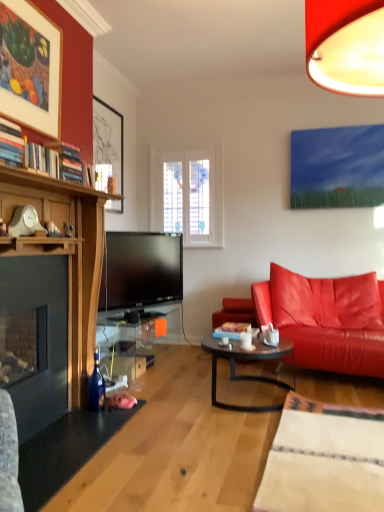
Question: From a real-world perspective, is dark brown glass coffee table at center over leather couch at right?

Choices:
 (A) no
 (B) yes

Answer: (A)

Question: Considering the relative sizes of dark brown glass coffee table at center and leather couch at right in the image provided, is dark brown glass coffee table at center thinner than leather couch at right?

Choices:
 (A) yes
 (B) no

Answer: (A)

Question: Considering the relative sizes of dark brown glass coffee table at center and leather couch at right in the image provided, is dark brown glass coffee table at center wider than leather couch at right?

Choices:
 (A) no
 (B) yes

Answer: (A)

Question: Is dark brown glass coffee table at center facing away from leather couch at right?

Choices:
 (A) no
 (B) yes

Answer: (B)

Question: Is dark brown glass coffee table at center positioned in front of leather couch at right?

Choices:
 (A) yes
 (B) no

Answer: (A)

Question: Considering the positions of point (39, 48) and point (251, 334), is point (39, 48) closer or farther from the camera than point (251, 334)?

Choices:
 (A) farther
 (B) closer

Answer: (B)

Question: Is matte wood picture frame at upper left, the second picture frame positioned from the back, spatially inside white ceramic mug at center, or outside of it?

Choices:
 (A) inside
 (B) outside

Answer: (B)

Question: In the image, is matte wood picture frame at upper left, which is counted as the 1th picture frame, starting from the front, on the left side or the right side of white ceramic mug at center?

Choices:
 (A) right
 (B) left

Answer: (B)

Question: Is matte wood picture frame at upper left, which is counted as the 1th picture frame, starting from the front, wider or thinner than white ceramic mug at center?

Choices:
 (A) thin
 (B) wide

Answer: (A)

Question: In the image, is leather couch at right positioned in front of or behind white ceramic mug at center?

Choices:
 (A) behind
 (B) front

Answer: (A)

Question: In the image, is leather couch at right on the left side or the right side of white ceramic mug at center?

Choices:
 (A) right
 (B) left

Answer: (A)

Question: In terms of width, does leather couch at right look wider or thinner when compared to white ceramic mug at center?

Choices:
 (A) wide
 (B) thin

Answer: (A)

Question: Considering the positions of leather couch at right and white ceramic mug at center in the image, is leather couch at right bigger or smaller than white ceramic mug at center?

Choices:
 (A) big
 (B) small

Answer: (A)

Question: Considering the relative positions of matte black picture frame at upper left, which is the second picture frame from front to back, and white ceramic mug at center in the image provided, is matte black picture frame at upper left, which is the second picture frame from front to back, to the left or to the right of white ceramic mug at center?

Choices:
 (A) left
 (B) right

Answer: (A)

Question: Would you say matte black picture frame at upper left, acting as the 1th picture frame starting from the back, is inside or outside white ceramic mug at center?

Choices:
 (A) outside
 (B) inside

Answer: (A)